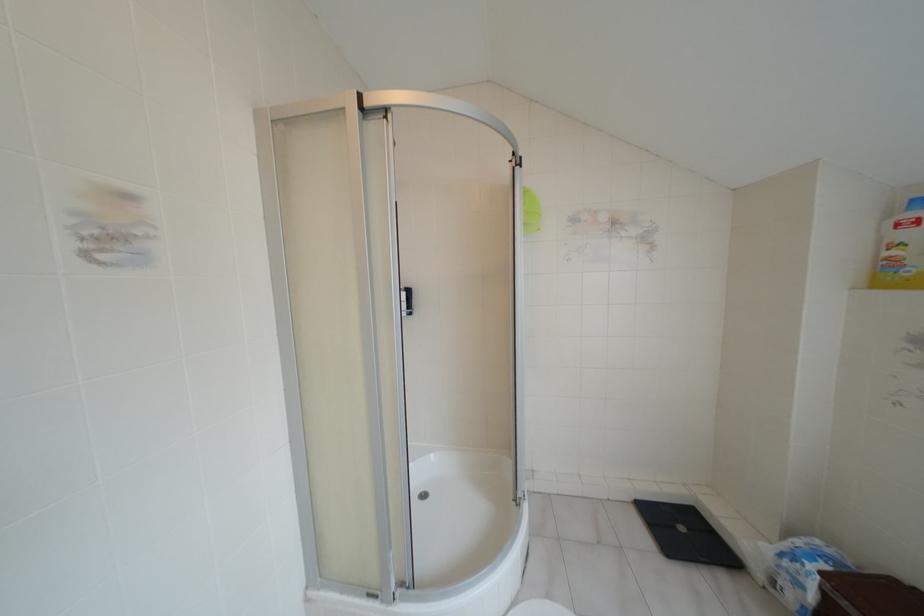
This screenshot has width=924, height=616. Find the location of `black digital scale`. black digital scale is located at coordinates (686, 533).